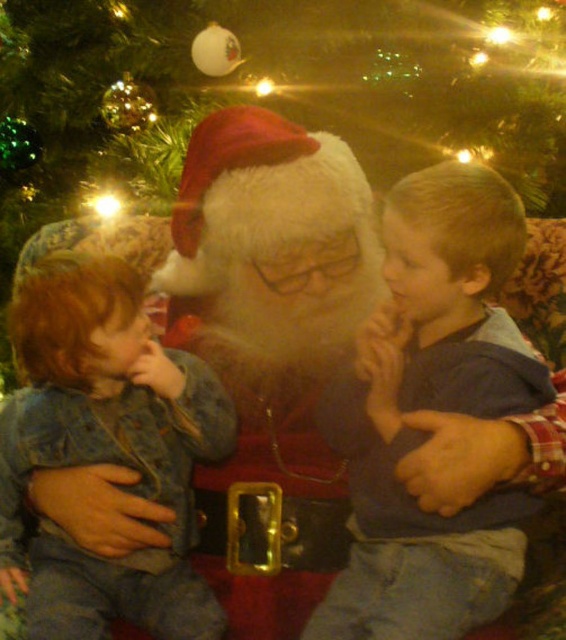
Question: Which point is farther from the camera taking this photo?

Choices:
 (A) (408, 236)
 (B) (213, 449)

Answer: (B)

Question: Which of the following is the closest to the observer?

Choices:
 (A) blue denim shirt at center
 (B) faded denim jacket at lower left

Answer: (A)

Question: Does blue denim shirt at center appear over faded denim jacket at lower left?

Choices:
 (A) yes
 (B) no

Answer: (A)

Question: Does blue denim shirt at center appear on the right side of faded denim jacket at lower left?

Choices:
 (A) yes
 (B) no

Answer: (A)

Question: Can you confirm if blue denim shirt at center is wider than faded denim jacket at lower left?

Choices:
 (A) no
 (B) yes

Answer: (A)